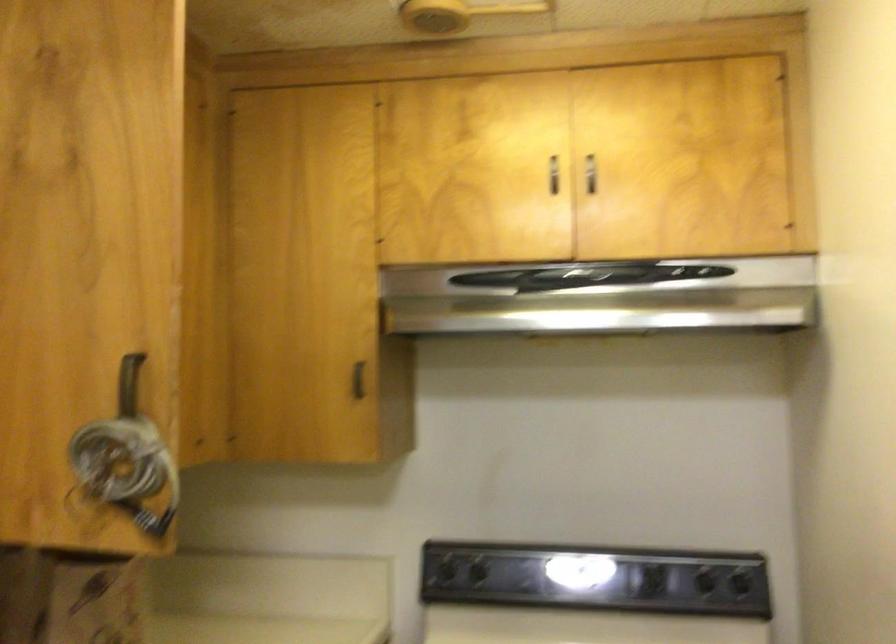
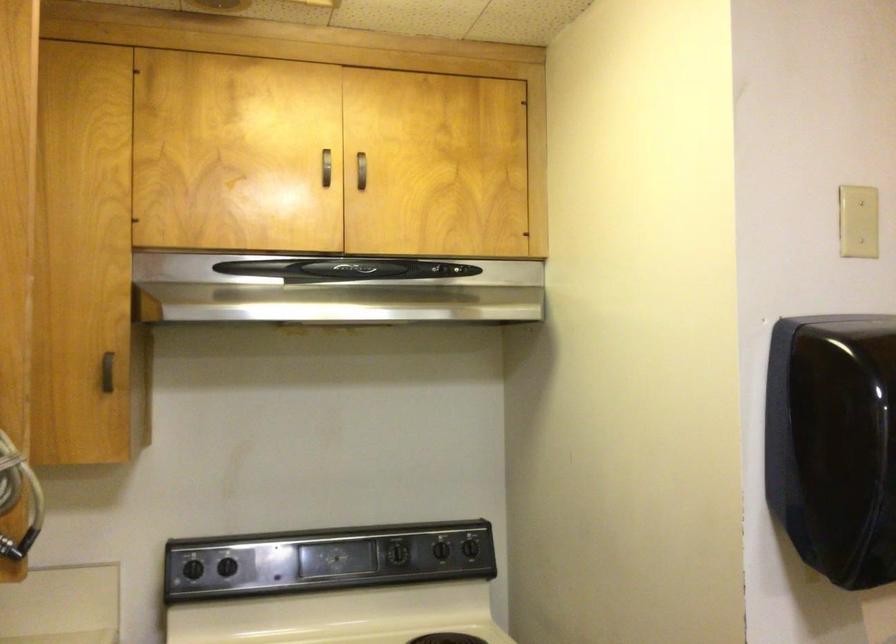
In the second image, find the point that corresponds to pixel 355 381 in the first image.

(107, 372)